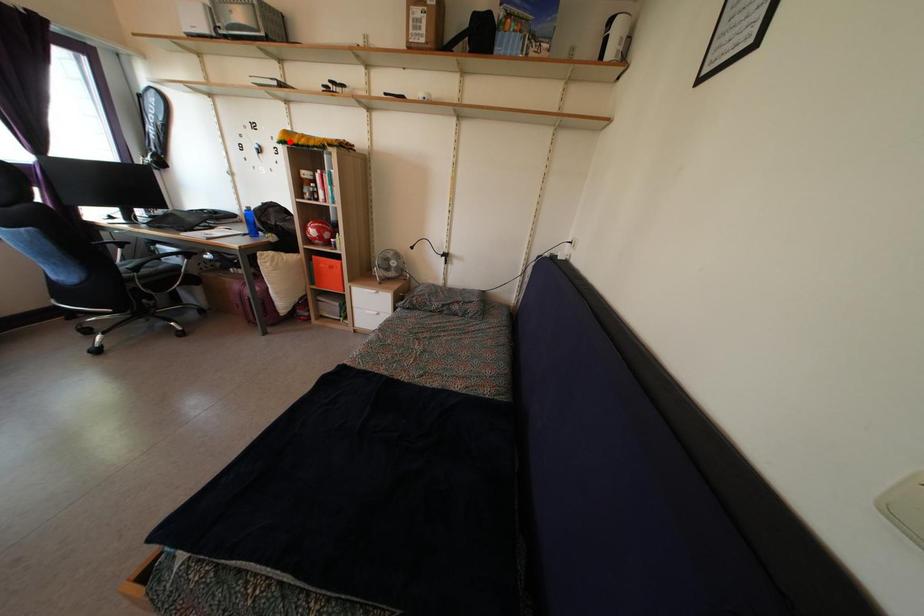
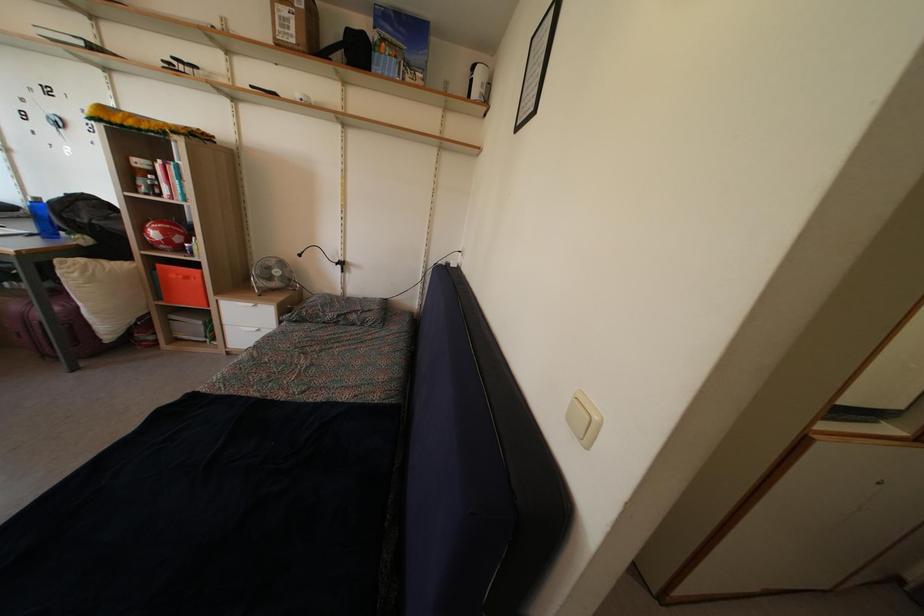
Question: A red point is marked in image1. In image2, is the corresponding 3D point closer to the camera or farther? Reply with the corresponding letter.

Choices:
 (A) The corresponding 3D point is closer.
 (B) The corresponding 3D point is farther.

Answer: (B)